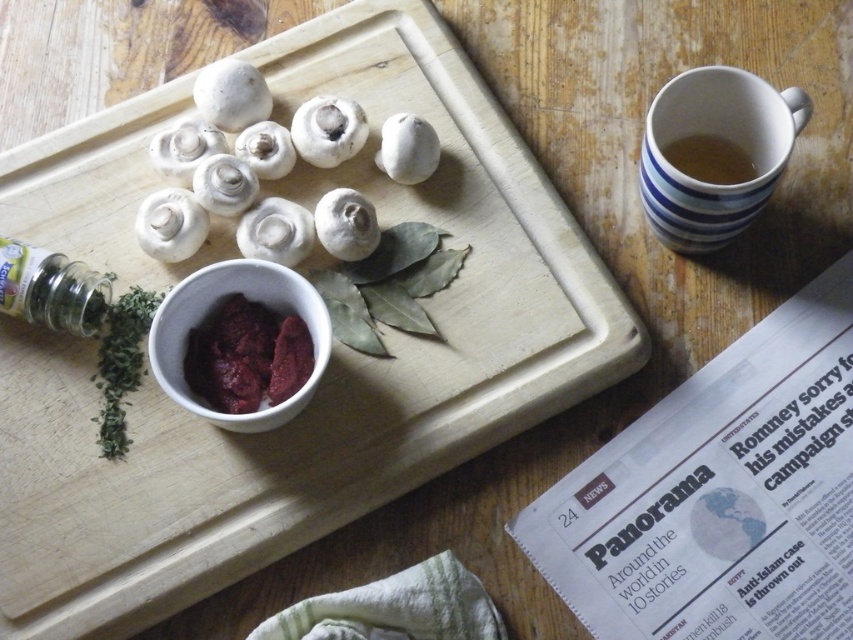
You are a chef preparing a dish and need to reach both the dark red paste at center and the green glass jar at lower left. Which object will you need to move first to access the one behind it?

The green glass jar at lower left is behind the dark red paste at center, so you need to move the dark red paste at center first to access the green glass jar at lower left.

You are a chef preparing a dish and need to use both the dark red paste at center and the green glass jar at lower left. Which item is closer to the edge of the table?

The dark red paste at center is positioned under the green glass jar at lower left, meaning the jar is closer to the edge of the table than the paste.

You are preparing a dish and need to reach for both the dark red paste at center and the brown ceramic mug at upper right. Which item would you need to move first to access the other?

The dark red paste at center is located below the brown ceramic mug at upper right, so you would need to move the brown ceramic mug at upper right first to access the dark red paste at center.